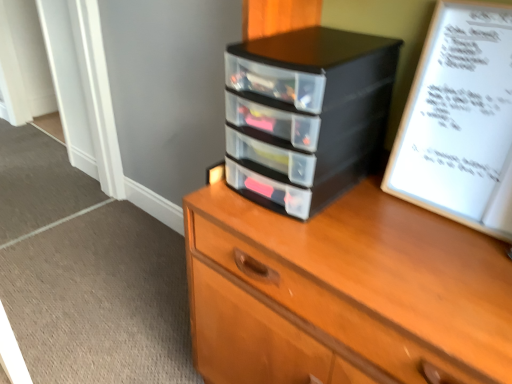
Question: From a real-world perspective, is black plastic drawers at center positioned over black plastic chest of drawers at center based on gravity?

Choices:
 (A) yes
 (B) no

Answer: (A)

Question: Does black plastic drawers at center have a lesser width compared to black plastic chest of drawers at center?

Choices:
 (A) no
 (B) yes

Answer: (B)

Question: Is black plastic drawers at center far from black plastic chest of drawers at center?

Choices:
 (A) yes
 (B) no

Answer: (B)

Question: Can we say black plastic drawers at center lies outside black plastic chest of drawers at center?

Choices:
 (A) no
 (B) yes

Answer: (A)

Question: Considering the relative sizes of black plastic drawers at center and black plastic chest of drawers at center in the image provided, is black plastic drawers at center smaller than black plastic chest of drawers at center?

Choices:
 (A) no
 (B) yes

Answer: (B)

Question: Is black plastic drawers at center aimed at black plastic chest of drawers at center?

Choices:
 (A) no
 (B) yes

Answer: (B)

Question: Can you confirm if black plastic chest of drawers at center is shorter than black plastic drawers at center?

Choices:
 (A) yes
 (B) no

Answer: (B)

Question: Is black plastic chest of drawers at center to the left of black plastic drawers at center from the viewer's perspective?

Choices:
 (A) yes
 (B) no

Answer: (B)

Question: Is black plastic chest of drawers at center aimed at black plastic drawers at center?

Choices:
 (A) yes
 (B) no

Answer: (A)

Question: From the image's perspective, does black plastic chest of drawers at center appear lower than black plastic drawers at center?

Choices:
 (A) yes
 (B) no

Answer: (A)

Question: Is black plastic chest of drawers at center closer to the viewer compared to black plastic drawers at center?

Choices:
 (A) yes
 (B) no

Answer: (A)

Question: Is black plastic chest of drawers at center far from black plastic drawers at center?

Choices:
 (A) yes
 (B) no

Answer: (B)

Question: Is white paper at upper right facing away from black plastic drawers at center?

Choices:
 (A) yes
 (B) no

Answer: (B)